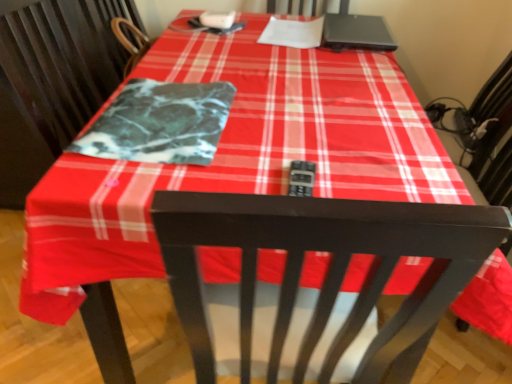
Where is `free spot above marble-like fabric at center (from a real-world perspective)`? The image size is (512, 384). free spot above marble-like fabric at center (from a real-world perspective) is located at coordinates (166, 109).